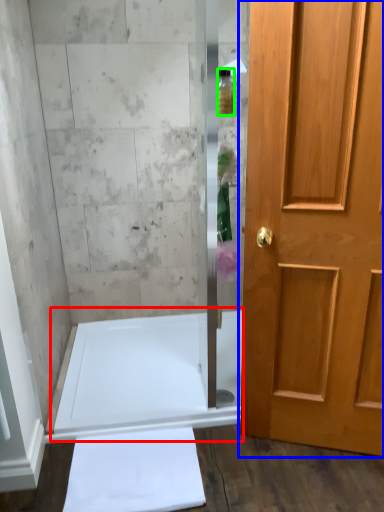
Question: Based on their relative distances, which object is farther from bath (highlighted by a red box)? Choose from door (highlighted by a blue box) and toiletry (highlighted by a green box).

Choices:
 (A) door
 (B) toiletry

Answer: (B)